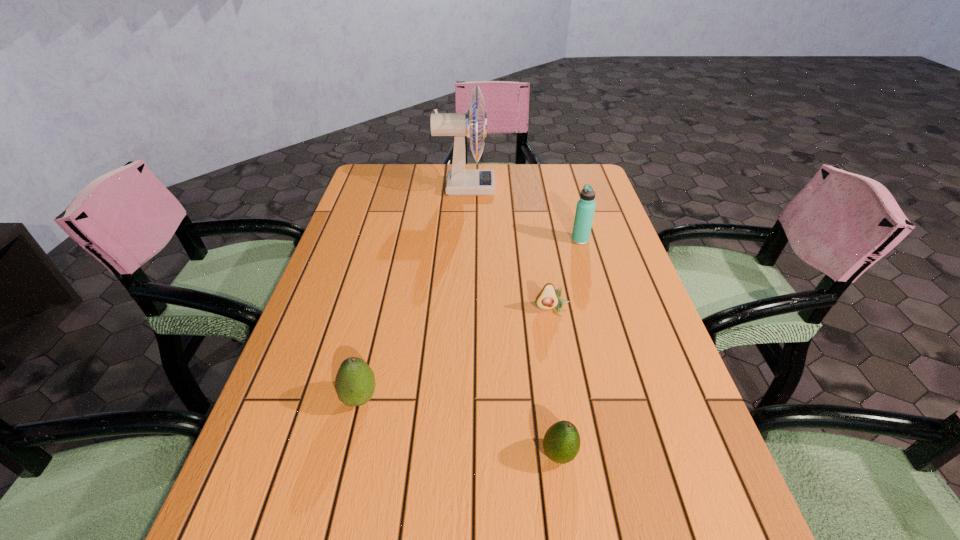
This screenshot has height=540, width=960. Identify the location of empty space between the fourth farthest object and the nearest avocado. (460, 426).

You are a GUI agent. You are given a task and a screenshot of the screen. Output one action in this format:
    pyautogui.click(x=<x>, y=<y>)
    Task: Click on the vacant space that is in between the rightmost object and the tallest avocado
    
    Given the screenshot: What is the action you would take?
    pyautogui.click(x=470, y=319)

Where is `vacant point located between the nearest avocado and the fourth object from right to left`? The height and width of the screenshot is (540, 960). vacant point located between the nearest avocado and the fourth object from right to left is located at coordinates (513, 321).

At what (x,y) coordinates should I click in order to perform the action: click on empty location between the nearest object and the tallest avocado. Please return your answer as a coordinate pair (x, y). The image size is (960, 540). Looking at the image, I should click on (460, 426).

Image resolution: width=960 pixels, height=540 pixels. Find the location of `free space that is in between the rightmost object and the third tallest object`. free space that is in between the rightmost object and the third tallest object is located at coordinates (470, 319).

The image size is (960, 540). In order to click on free space between the leftmost object and the second object from left to right in this screenshot , I will do `click(413, 293)`.

Where is `vacant region between the tallest avocado and the thermos bottle`? vacant region between the tallest avocado and the thermos bottle is located at coordinates (470, 319).

Where is `free space that is in between the farthest avocado and the thermos bottle`? This screenshot has height=540, width=960. free space that is in between the farthest avocado and the thermos bottle is located at coordinates (566, 275).

This screenshot has width=960, height=540. What are the coordinates of `vacant space that's between the thermos bottle and the third farthest object` in the screenshot? It's located at (566, 275).

Where is `free space between the second tallest object and the farthest object`? free space between the second tallest object and the farthest object is located at coordinates (523, 214).